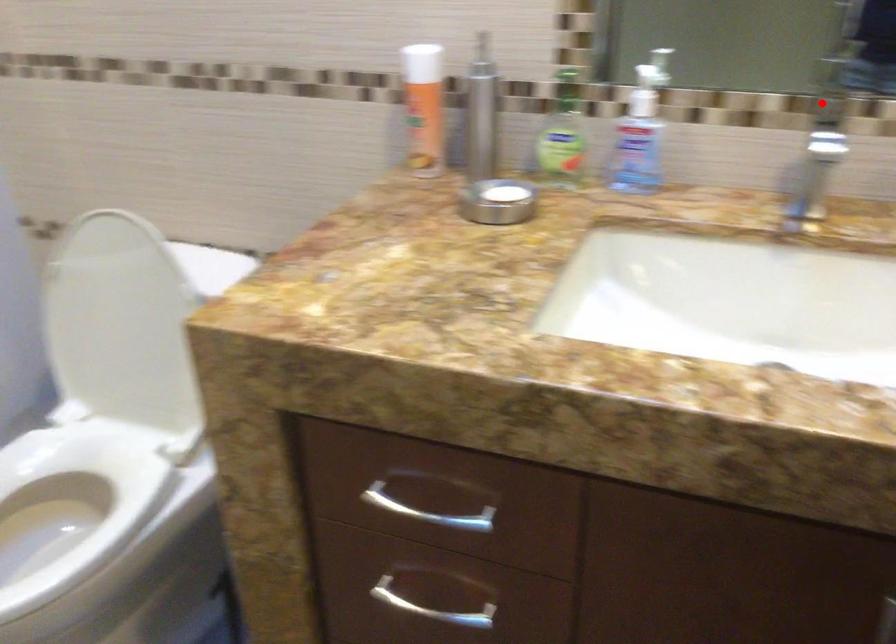
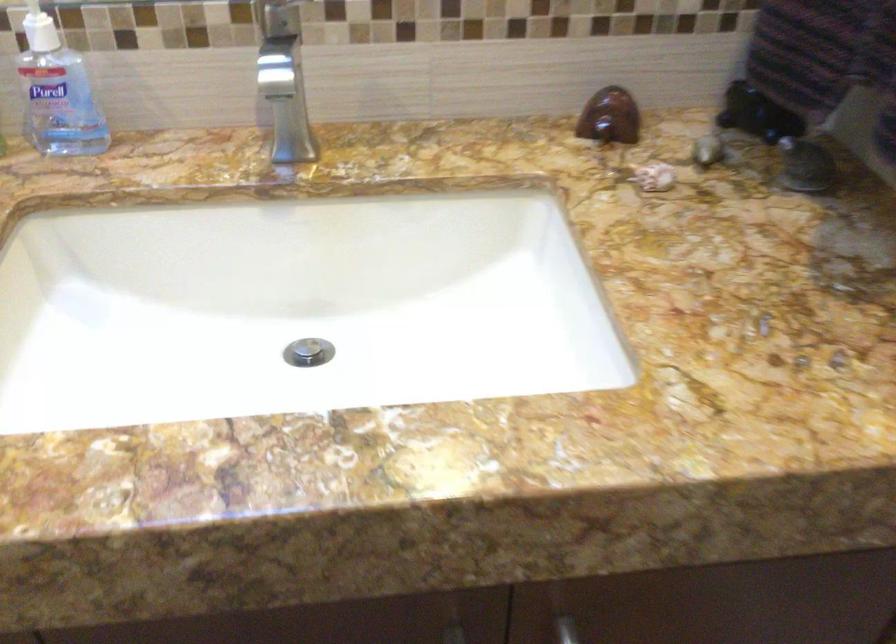
Where in the second image is the point corresponding to the highlighted location from the first image?

(268, 14)